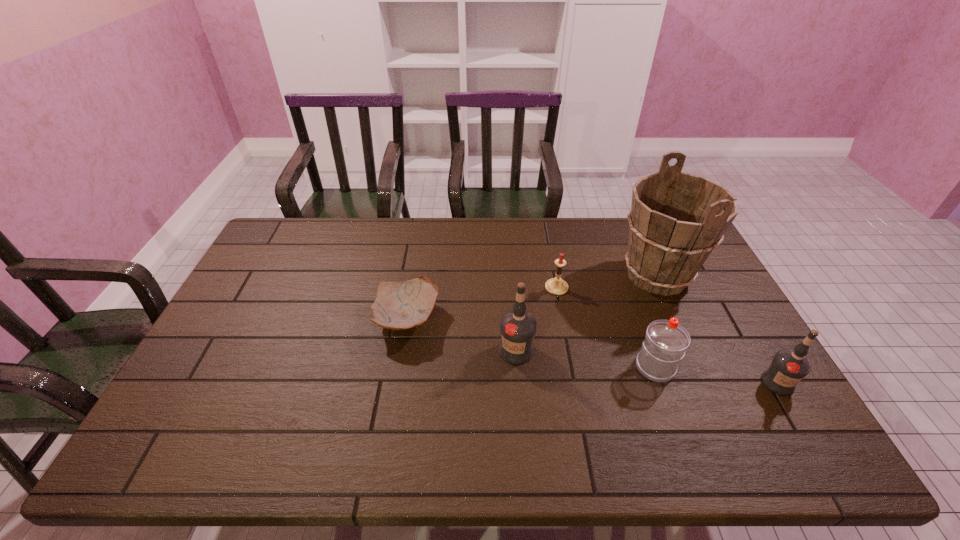
Where is `vacant space in between the taller vodka and the candle`? The image size is (960, 540). vacant space in between the taller vodka and the candle is located at coordinates (537, 319).

Image resolution: width=960 pixels, height=540 pixels. What are the coordinates of `vacant space that is in between the tallest object and the shorter vodka` in the screenshot? It's located at (717, 329).

This screenshot has width=960, height=540. Find the location of `free space between the rightmost object and the tallest object`. free space between the rightmost object and the tallest object is located at coordinates (717, 329).

Image resolution: width=960 pixels, height=540 pixels. Find the location of `free spot between the leftmost object and the right vodka`. free spot between the leftmost object and the right vodka is located at coordinates point(592,352).

Point out which object is positioned as the fifth nearest to the fourth object from right to left. Please provide its 2D coordinates. Your answer should be formatted as a tuple, i.e. [(x, y)], where the tuple contains the x and y coordinates of a point satisfying the conditions above.

[(788, 367)]

Identify which object is the third nearest to the second shortest object. Please provide its 2D coordinates. Your answer should be formatted as a tuple, i.e. [(x, y)], where the tuple contains the x and y coordinates of a point satisfying the conditions above.

[(666, 341)]